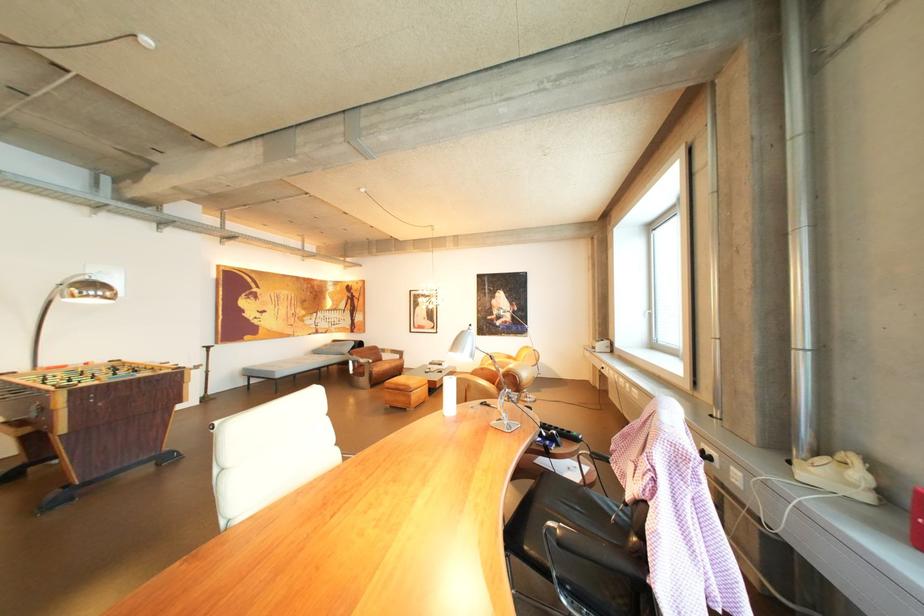
Where is `black chair sitting surface`? black chair sitting surface is located at coordinates click(x=576, y=505).